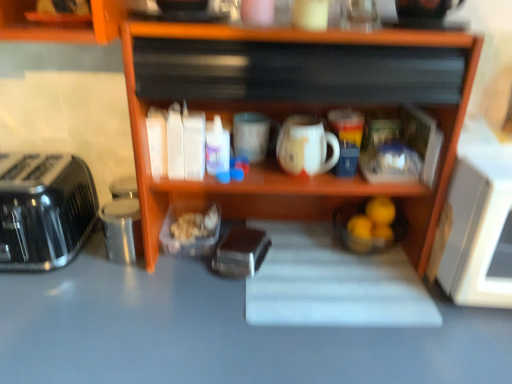
This screenshot has height=384, width=512. Find the location of `vacant region in front of wooden shelf at center`. vacant region in front of wooden shelf at center is located at coordinates click(262, 344).